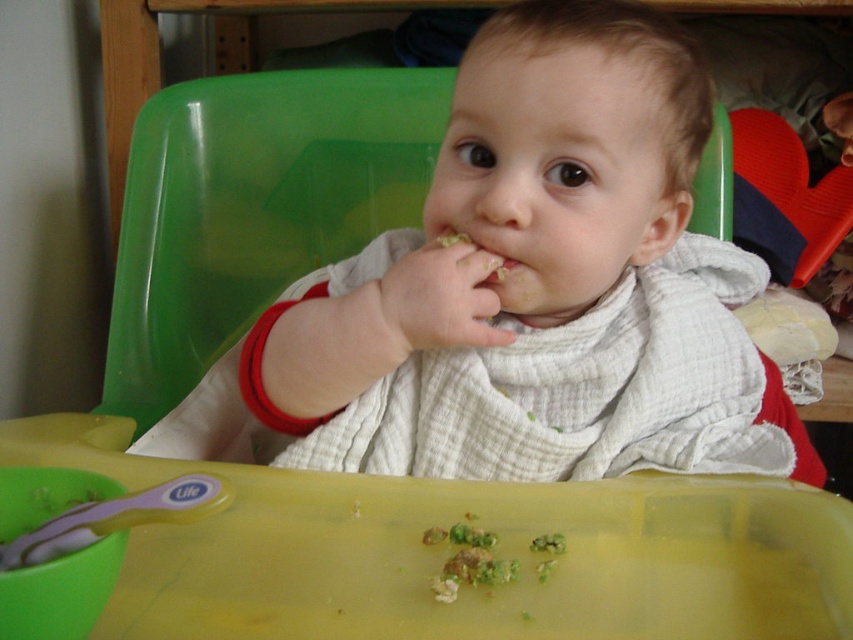
You are a parent standing in front of the high chair. You want to check if you can reach the white textured bib at center to adjust it. Considering your hand can extend 20 inches forward, can you comfortably reach it?

The white textured bib at center is 18.14 inches away from the viewer. Since your hand can extend 20 inches forward, you can comfortably reach the white textured bib at center.

Consider the image. You are a parent trying to clean up after your child. You see the white textured bib at center and the green textured food at tray center. Which item should you reach for first if you want to clean the area closest to your child?

The white textured bib at center is on the right side of the green textured food at tray center, so you should reach for the green textured food at tray center first as it is closer to the child.